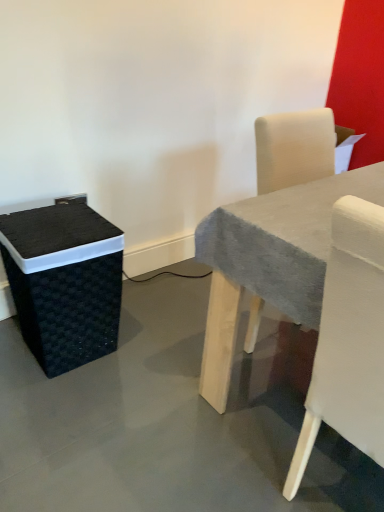
Question: Is smooth gray table at center closer to the viewer compared to black woven basket at left?

Choices:
 (A) no
 (B) yes

Answer: (B)

Question: From a real-world perspective, does smooth gray table at center stand above black woven basket at left?

Choices:
 (A) no
 (B) yes

Answer: (B)

Question: Considering the relative sizes of smooth gray table at center and black woven basket at left in the image provided, is smooth gray table at center thinner than black woven basket at left?

Choices:
 (A) no
 (B) yes

Answer: (A)

Question: Is smooth gray table at center turned away from black woven basket at left?

Choices:
 (A) no
 (B) yes

Answer: (A)

Question: Does smooth gray table at center have a lesser height compared to black woven basket at left?

Choices:
 (A) yes
 (B) no

Answer: (B)

Question: Looking at their shapes, would you say white fabric chair at right is wider or thinner than black woven basket at left?

Choices:
 (A) wide
 (B) thin

Answer: (A)

Question: From a real-world perspective, is white fabric chair at right positioned above or below black woven basket at left?

Choices:
 (A) below
 (B) above

Answer: (B)

Question: Visually, is white fabric chair at right positioned to the left or to the right of black woven basket at left?

Choices:
 (A) right
 (B) left

Answer: (A)

Question: In terms of height, does white fabric chair at right look taller or shorter compared to black woven basket at left?

Choices:
 (A) tall
 (B) short

Answer: (A)

Question: From the image's perspective, relative to smooth gray table at center, is white fabric chair at right above or below?

Choices:
 (A) below
 (B) above

Answer: (A)

Question: Relative to smooth gray table at center, is white fabric chair at right in front or behind?

Choices:
 (A) behind
 (B) front

Answer: (B)

Question: Which is correct: white fabric chair at right is inside smooth gray table at center, or outside of it?

Choices:
 (A) outside
 (B) inside

Answer: (A)

Question: In terms of height, does white fabric chair at right look taller or shorter compared to smooth gray table at center?

Choices:
 (A) short
 (B) tall

Answer: (B)

Question: Would you say smooth gray table at center is to the left or to the right of black woven basket at left in the picture?

Choices:
 (A) left
 (B) right

Answer: (B)

Question: Considering the positions of smooth gray table at center and black woven basket at left in the image, is smooth gray table at center wider or thinner than black woven basket at left?

Choices:
 (A) wide
 (B) thin

Answer: (A)